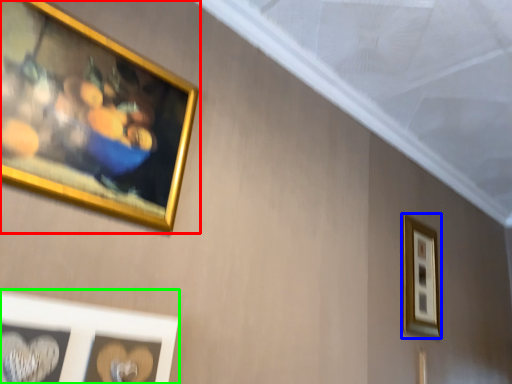
Question: Considering the real-world distances, which object is farthest from picture frame (highlighted by a red box)? picture frame (highlighted by a blue box) or picture frame (highlighted by a green box)?

Choices:
 (A) picture frame
 (B) picture frame

Answer: (A)